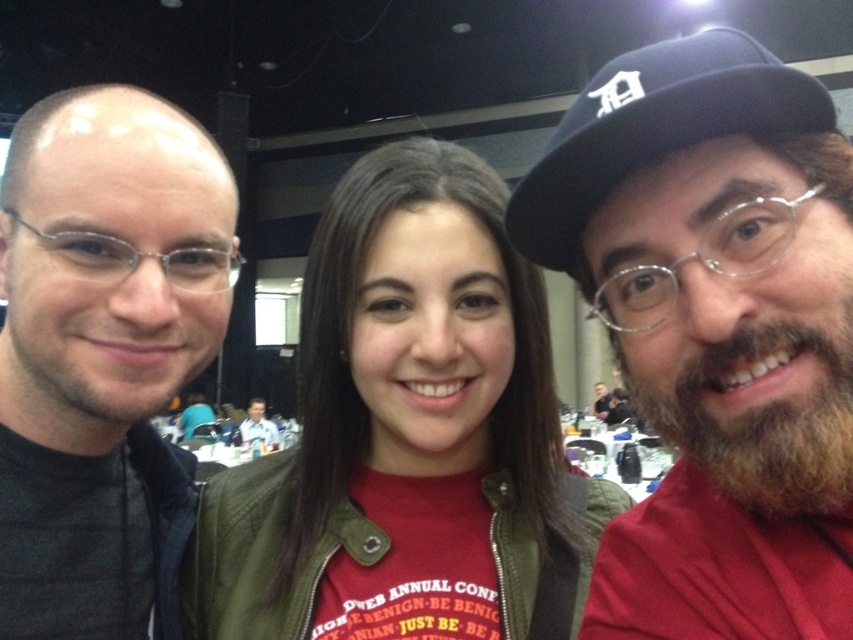
Looking at this image, you are a photographer at the event and need to ensure all attendees in the photo are visible. Given the current composition, will the bearded man at right and the smooth skin face at center both be fully visible in the frame?

The bearded man at right is smaller than the smooth skin face at center, which suggests he may be positioned farther away or closer to the edge of the frame. To ensure full visibility, adjust their positions so both are centered or move closer to the camera.

You are a photographer at the event. You need to adjust the lighting so that the bearded man at right and the smooth skin face at center are both well lit. Which one is closer to the light source?

The bearded man at right is positioned over smooth skin face at center, so the bearded man at right is closer to the light source.

You are a photographer at the event and need to ensure all jackets are visible in the group photo. Given that the matte olive green jacket at center and the matte black jacket at left are part of the group, which jacket requires more horizontal space to fully capture in the photo?

The matte olive green jacket at center requires more horizontal space because its width is larger than the matte black jacket at left.